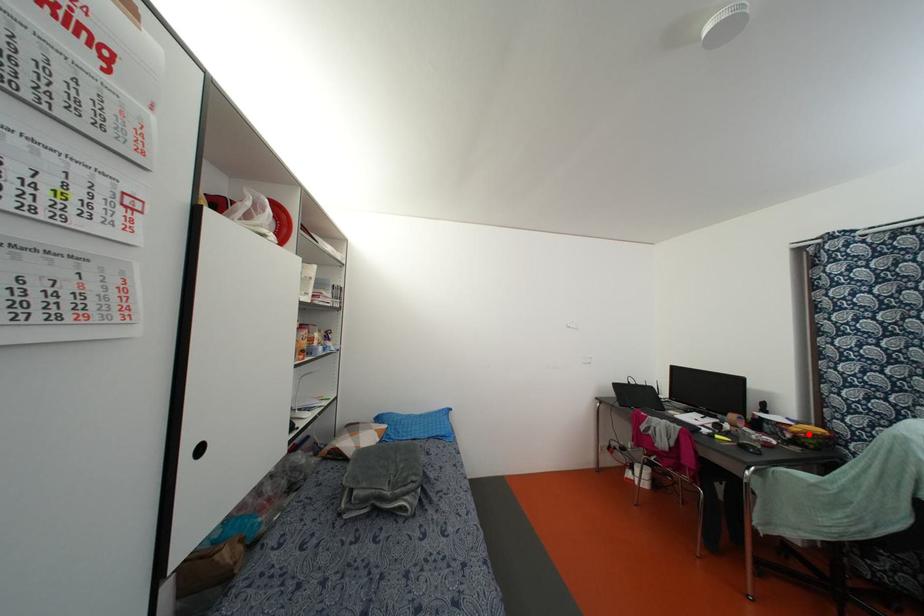
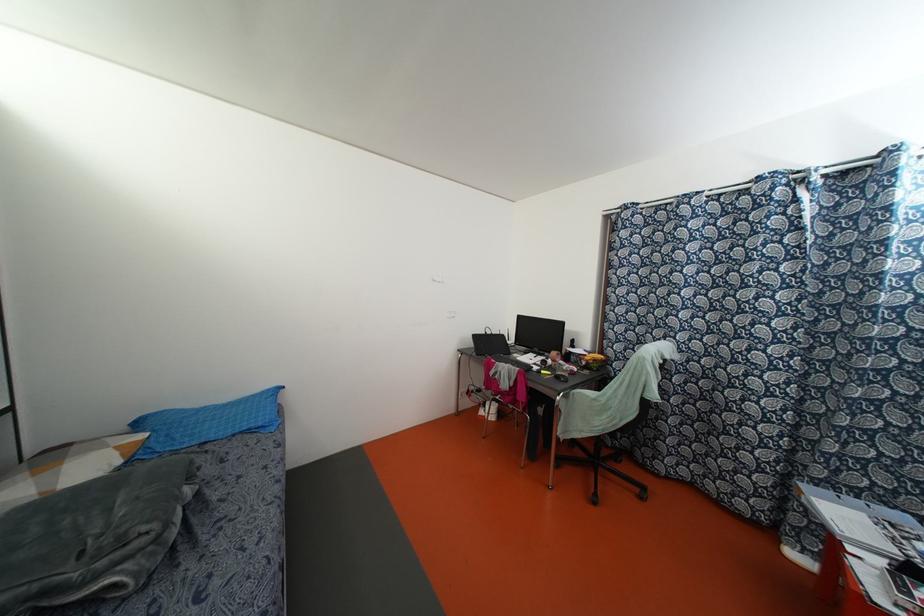
Question: I am providing you with two images of the same scene from different viewpoints. A red point is shown in image1. For the corresponding object point in image2, is it positioned nearer or farther from the camera?

Choices:
 (A) Nearer
 (B) Farther

Answer: (A)